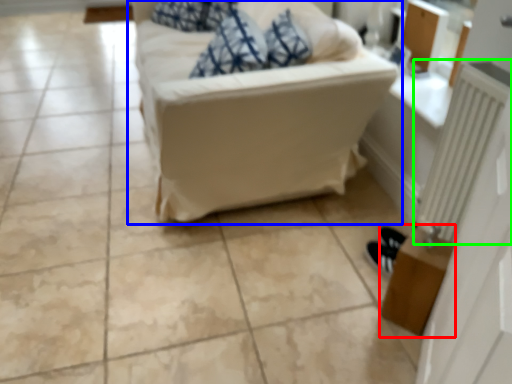
Question: Which object is positioned farthest from table (highlighted by a red box)? Select from studio couch (highlighted by a blue box) and radiator (highlighted by a green box).

Choices:
 (A) studio couch
 (B) radiator

Answer: (A)